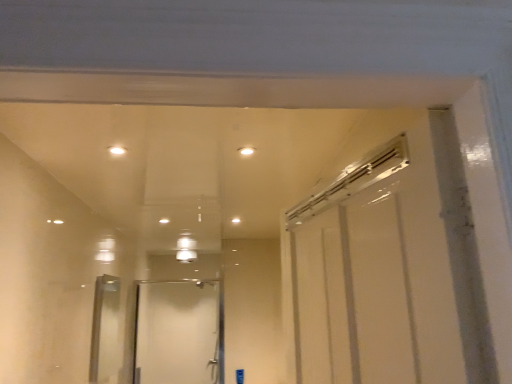
Question: From a real-world perspective, is white glossy light at upper center, the 1th light in the left-to-right sequence, positioned above or below white glossy light at upper center, which is the second light in left-to-right order?

Choices:
 (A) above
 (B) below

Answer: (A)

Question: Is white glossy light at upper center, arranged as the 2th light when viewed from the right, taller or shorter than white glossy light at upper center, which is the 1th light from right to left?

Choices:
 (A) short
 (B) tall

Answer: (B)

Question: Considering the real-world distances, which object is farthest from the clear glass door at center?

Choices:
 (A) white glossy light at upper center, arranged as the 2th light when viewed from the right
 (B) white glossy light at upper center, which is the 1th light from right to left

Answer: (B)

Question: Which of these objects is positioned farthest from the white glossy light at upper center, which is the second light in left-to-right order?

Choices:
 (A) white glossy light at upper center, the 1th light in the left-to-right sequence
 (B) clear glass door at center

Answer: (B)